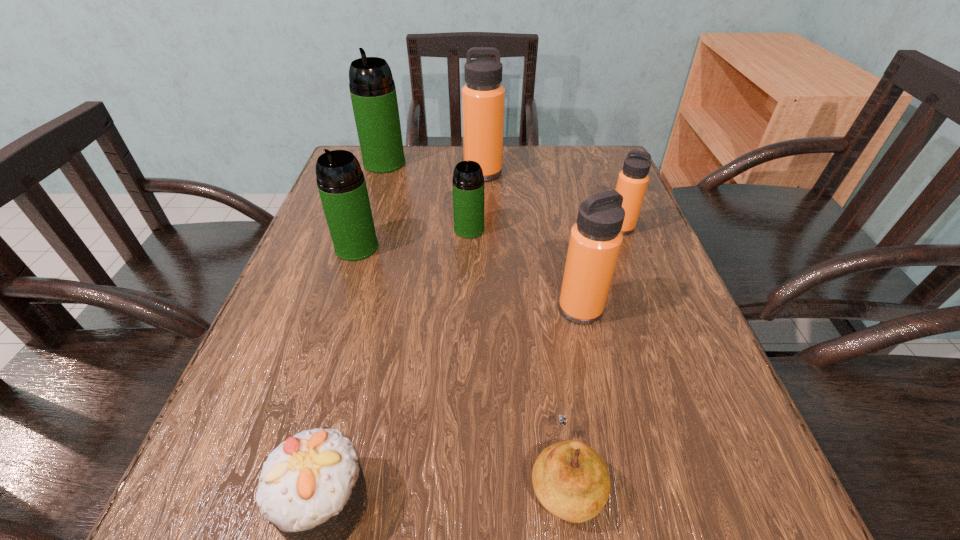
Image resolution: width=960 pixels, height=540 pixels. I want to click on vacant space that satisfies the following two spatial constraints: 1. from the spout of the second orange thermos bottle from left to right; 2. on the left side of the biggest green thermos bottle, so click(338, 309).

I want to click on free location that satisfies the following two spatial constraints: 1. from the spout of the rightmost green thermos bottle; 2. on the left side of the nearest orange thermos bottle, so click(467, 309).